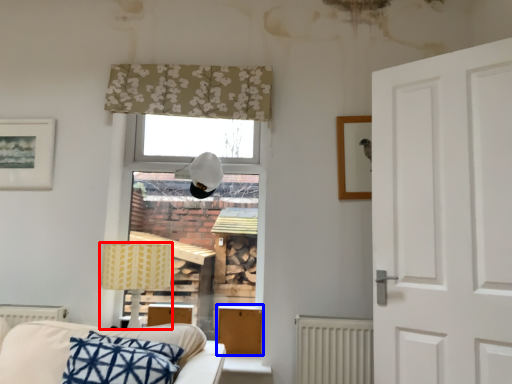
Question: Which point is closer to the camera, table lamp (highlighted by a red box) or furniture (highlighted by a blue box)?

Choices:
 (A) table lamp
 (B) furniture

Answer: (A)